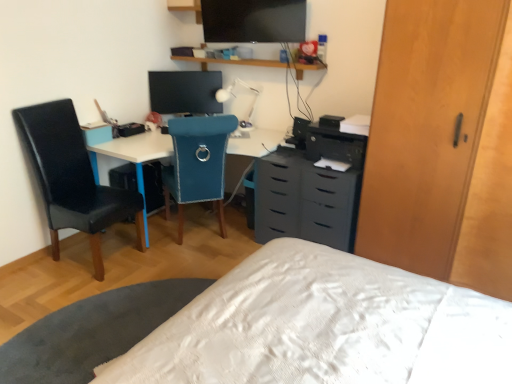
Measure the distance between point (211, 85) and camera.

Point (211, 85) and camera are 3.68 meters apart from each other.

In order to click on teal fabric chair at center, placed as the 1th chair when sorted from right to left in this screenshot , I will do `click(197, 164)`.

Measure the distance between point [333,200] and camera.

They are 2.83 meters apart.

The height and width of the screenshot is (384, 512). What do you see at coordinates (305, 200) in the screenshot?
I see `matte gray chest of drawers at center` at bounding box center [305, 200].

This screenshot has width=512, height=384. In order to click on black leather chair at left, placed as the second chair when sorted from right to left in this screenshot , I will do `click(73, 178)`.

You are a GUI agent. You are given a task and a screenshot of the screen. Output one action in this format:
    pyautogui.click(x=<x>, y=<y>)
    Task: Click on the wooden shelf at upper center
    This screenshot has width=512, height=384.
    Given the screenshot: What is the action you would take?
    pyautogui.click(x=253, y=64)

Consider the image. From a real-world perspective, who is located lower, light brown wood dresser at right or matte gray chest of drawers at center?

From a 3D spatial view, matte gray chest of drawers at center is below.

The image size is (512, 384). Find the location of `dresser that appears on the right of matte gray chest of drawers at center`. dresser that appears on the right of matte gray chest of drawers at center is located at coordinates (442, 145).

In the image, is light brown wood dresser at right positioned in front of or behind matte gray chest of drawers at center?

Clearly, light brown wood dresser at right is in front of matte gray chest of drawers at center.

From a real-world perspective, is black leather chair at left, the first chair in the left-to-right sequence, positioned over teal fabric chair at center, arranged as the second chair when viewed from the left, based on gravity?

Yes, from a real-world perspective, black leather chair at left, the first chair in the left-to-right sequence, is on top of teal fabric chair at center, arranged as the second chair when viewed from the left.

Does point (110, 199) lie behind point (188, 186)?

That is False.

How different are the orientations of black leather chair at left, the first chair in the left-to-right sequence, and teal fabric chair at center, arranged as the second chair when viewed from the left, in degrees?

There is a 132-degree angle between the facing directions of black leather chair at left, the first chair in the left-to-right sequence, and teal fabric chair at center, arranged as the second chair when viewed from the left.

Considering the positions of objects black leather chair at left, placed as the second chair when sorted from right to left, and teal fabric chair at center, placed as the 1th chair when sorted from right to left, in the image provided, who is behind, black leather chair at left, placed as the second chair when sorted from right to left, or teal fabric chair at center, placed as the 1th chair when sorted from right to left,?

teal fabric chair at center, placed as the 1th chair when sorted from right to left, is further away from the camera.

Would you say black leather chair at left, the first chair in the left-to-right sequence, contains white glossy table at lower left?

No, white glossy table at lower left is located outside of black leather chair at left, the first chair in the left-to-right sequence.

Is black leather chair at left, placed as the second chair when sorted from right to left, bigger than white glossy table at lower left?

Yes.

From the image's perspective, is black leather chair at left, the first chair in the left-to-right sequence, under white glossy table at lower left?

Actually, black leather chair at left, the first chair in the left-to-right sequence, appears above white glossy table at lower left in the image.

Which is in front, point (59, 128) or point (86, 346)?

The point (86, 346) is closer.

Who is bigger, white plastic desk at center or light brown wood dresser at right?

Bigger between the two is light brown wood dresser at right.

Which object is thinner, white plastic desk at center or light brown wood dresser at right?

light brown wood dresser at right is thinner.

Is white plastic desk at center facing away from light brown wood dresser at right?

No, light brown wood dresser at right is not at the back of white plastic desk at center.

I want to click on dresser that appears above the white plastic desk at center (from a real-world perspective), so tap(442, 145).

From the image's perspective, which one is positioned higher, flat matte screen at upper center or matte black monitor at center?

flat matte screen at upper center appears higher in the image.

Is point (259, 8) closer to viewer compared to point (158, 93)?

Yes, point (259, 8) is in front of point (158, 93).

Considering the positions of objects flat matte screen at upper center and matte black monitor at center in the image provided, who is more to the left, flat matte screen at upper center or matte black monitor at center?

From the viewer's perspective, matte black monitor at center appears more on the left side.

Would you say flat matte screen at upper center is a long distance from matte black monitor at center?

No, flat matte screen at upper center is not far away from matte black monitor at center.

Does matte gray chest of drawers at center have a lesser height compared to light brown wood dresser at right?

Indeed, matte gray chest of drawers at center has a lesser height compared to light brown wood dresser at right.

From a real-world perspective, who is located higher, matte gray chest of drawers at center or light brown wood dresser at right?

light brown wood dresser at right, from a real-world perspective.

Is matte gray chest of drawers at center not inside light brown wood dresser at right?

matte gray chest of drawers at center is positioned outside light brown wood dresser at right.

Is matte gray chest of drawers at center positioned before light brown wood dresser at right?

No, matte gray chest of drawers at center is behind light brown wood dresser at right.

Is point (249, 90) closer or farther from the camera than point (180, 158)?

Point (249, 90).

Identify the location of table lamp that is above the teal fabric chair at center, arranged as the second chair when viewed from the left (from a real-world perspective). This screenshot has width=512, height=384. (241, 101).

Can you confirm if white plastic table lamp at center is positioned to the left of teal fabric chair at center, arranged as the second chair when viewed from the left?

Incorrect, white plastic table lamp at center is not on the left side of teal fabric chair at center, arranged as the second chair when viewed from the left.

From the image's perspective, which one is positioned lower, white plastic table lamp at center or teal fabric chair at center, arranged as the second chair when viewed from the left?

teal fabric chair at center, arranged as the second chair when viewed from the left, appears lower in the image.

Where is `dresser that is on the right side of matte gray chest of drawers at center`? This screenshot has width=512, height=384. dresser that is on the right side of matte gray chest of drawers at center is located at coordinates (442, 145).

Image resolution: width=512 pixels, height=384 pixels. In order to click on chair in front of the teal fabric chair at center, placed as the 1th chair when sorted from right to left in this screenshot , I will do 73,178.

From the image, which object appears to be farther from black leather chair at left, placed as the second chair when sorted from right to left, white plastic table lamp at center or teal fabric chair at center, arranged as the second chair when viewed from the left?

white plastic table lamp at center is further to black leather chair at left, placed as the second chair when sorted from right to left.

When comparing their distances from teal fabric chair at center, arranged as the second chair when viewed from the left, does wooden shelf at upper center or light brown wood dresser at right seem further?

light brown wood dresser at right lies further to teal fabric chair at center, arranged as the second chair when viewed from the left, than the other object.

Looking at the image, which one is located further to teal fabric chair at center, arranged as the second chair when viewed from the left, white plastic table lamp at center or white plastic desk at center?

The object further to teal fabric chair at center, arranged as the second chair when viewed from the left, is white plastic table lamp at center.

In the scene shown: Which object lies further to the anchor point teal fabric chair at center, placed as the 1th chair when sorted from right to left, wooden shelf at upper center or flat matte screen at upper center?

wooden shelf at upper center lies further to teal fabric chair at center, placed as the 1th chair when sorted from right to left, than the other object.

From the picture: From the image, which object appears to be nearer to black leather chair at left, placed as the second chair when sorted from right to left, white glossy table at lower left or matte black monitor at center?

Based on the image, white glossy table at lower left appears to be nearer to black leather chair at left, placed as the second chair when sorted from right to left.

When comparing their distances from white plastic desk at center, does flat matte screen at upper center or teal fabric chair at center, placed as the 1th chair when sorted from right to left, seem closer?

teal fabric chair at center, placed as the 1th chair when sorted from right to left, is positioned closer to the anchor white plastic desk at center.

Estimate the real-world distances between objects in this image. Which object is closer to matte gray chest of drawers at center, white plastic table lamp at center or black leather chair at left, placed as the second chair when sorted from right to left?

Among the two, white plastic table lamp at center is located nearer to matte gray chest of drawers at center.

Based on their spatial positions, is white glossy table at lower left or teal fabric chair at center, arranged as the second chair when viewed from the left, further from wooden shelf at upper center?

white glossy table at lower left.

Find the location of a particular element. The height and width of the screenshot is (384, 512). chair between teal fabric chair at center, arranged as the second chair when viewed from the left, and white glossy table at lower left, in the vertical direction is located at coordinates (73, 178).

Image resolution: width=512 pixels, height=384 pixels. In order to click on computer monitor located between white glossy table at lower left and light brown wood dresser at right in the left-right direction in this screenshot , I will do `click(185, 92)`.

The height and width of the screenshot is (384, 512). Identify the location of chair between black leather chair at left, placed as the second chair when sorted from right to left, and white plastic table lamp at center in the front-back direction. (197, 164).

What are the coordinates of `desk between white glossy table at lower left and white plastic table lamp at center from front to back` in the screenshot? It's located at (133, 151).